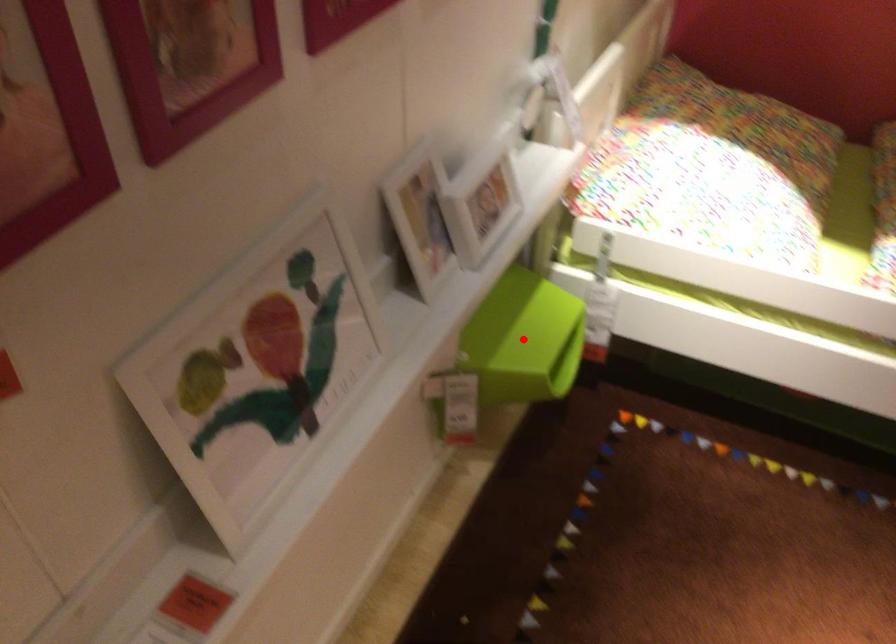
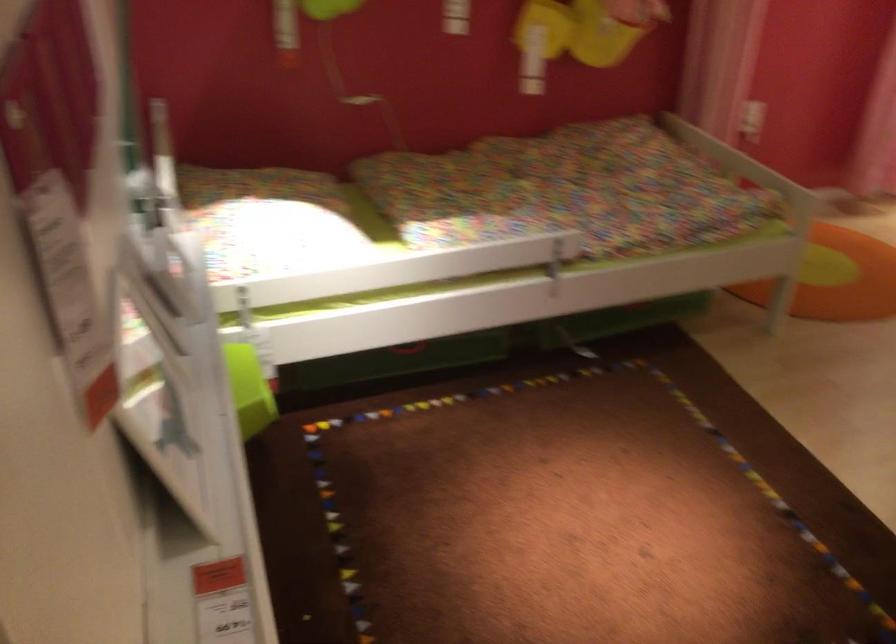
Question: I am providing you with two images of the same scene from different viewpoints. A red point is marked on the first image. Can you still see the location of the red point in image 2?

Choices:
 (A) Yes
 (B) No

Answer: (B)